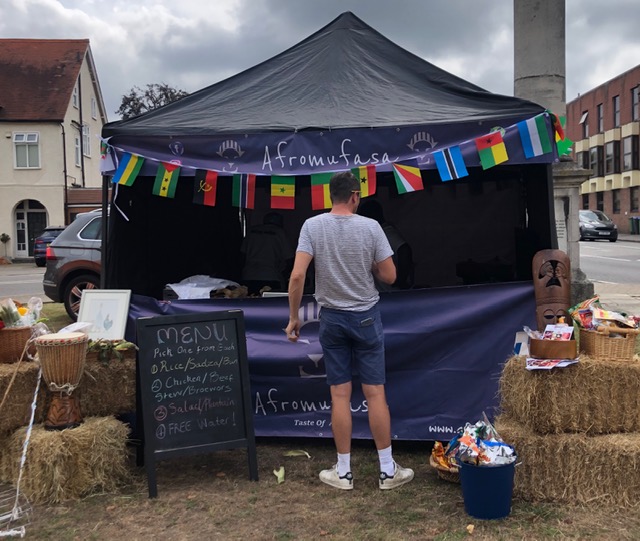
The width and height of the screenshot is (640, 541). In order to click on trash in this screenshot , I will do `click(500, 489)`.